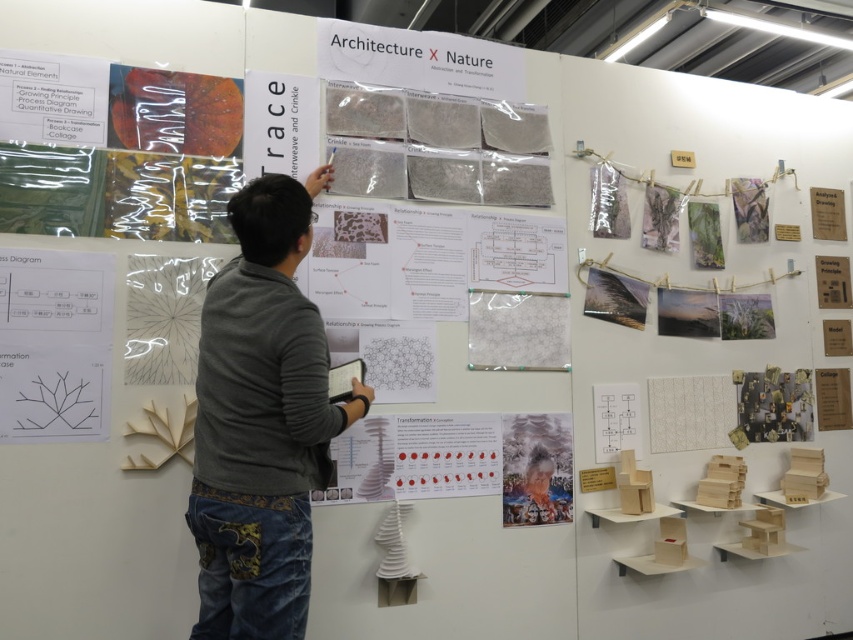
You are an architect visiting the exhibition. You notice two materials displayed at the center of the scene. The gray sweater at center and the white felt at center. Which one is positioned to the left?

The gray sweater at center is positioned to the left of the white felt at center.

You are an architect reviewing the exhibition setup. You notice the black line diagram at lower left and the white felt at center. Which object is closer to you as you face the exhibition wall?

The black line diagram at lower left is closer to you because it is in front of the white felt at center.

You are an architect visiting the exhibition and see the gray sweater at center and the white felt at center displayed on the same table. Which object is taller?

The gray sweater at center is much taller than the white felt at center.